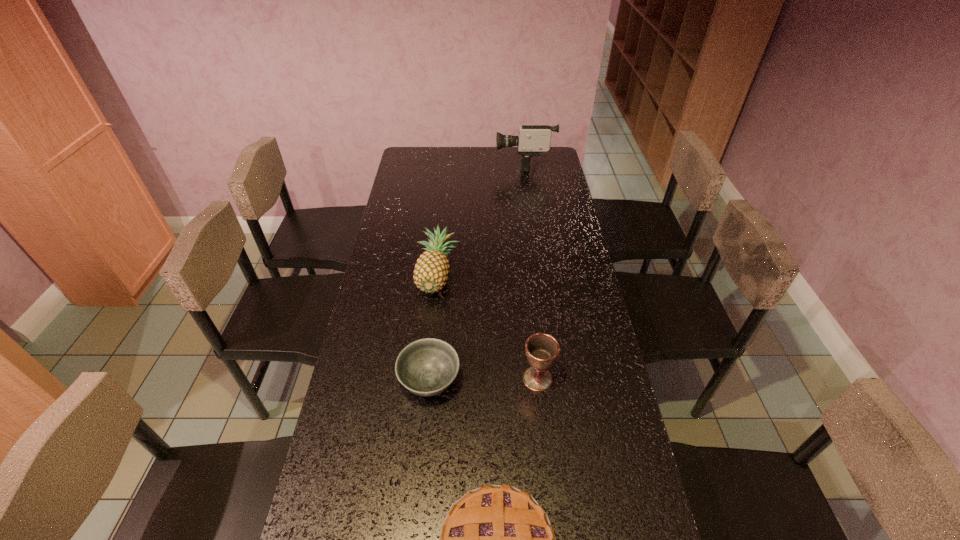
The image size is (960, 540). Identify the location of vacant space that's between the chalice and the tallest object. (531, 271).

At what (x,y) coordinates should I click in order to perform the action: click on vacant region between the fourth tallest object and the chalice. Please return your answer as a coordinate pair (x, y). This screenshot has width=960, height=540. Looking at the image, I should click on (484, 380).

What are the coordinates of `unoccupied area between the pineapple and the tallest object` in the screenshot? It's located at (481, 218).

Image resolution: width=960 pixels, height=540 pixels. I want to click on empty space between the fourth nearest object and the chalice, so click(x=488, y=326).

The image size is (960, 540). I want to click on free space between the chalice and the bowl, so (x=484, y=380).

Find the location of a particular element. The height and width of the screenshot is (540, 960). vacant area that lies between the chalice and the tallest object is located at coordinates (531, 271).

The image size is (960, 540). Find the location of `the second closest object to the bowl`. the second closest object to the bowl is located at coordinates (496, 539).

This screenshot has height=540, width=960. Find the location of `object that stands as the second closest to the pie`. object that stands as the second closest to the pie is located at coordinates (541, 349).